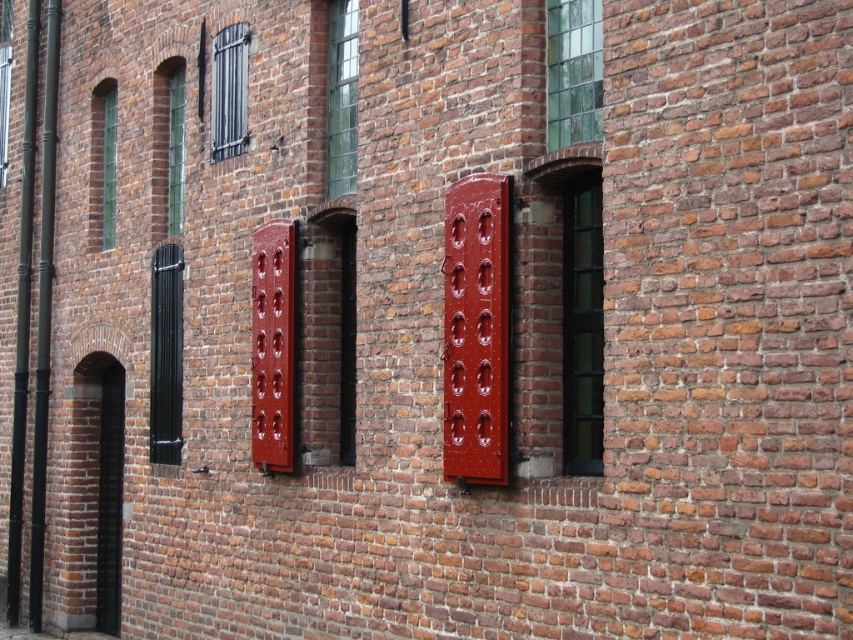
Which of these two, green glass window at upper center or green stained glass window at upper left, stands taller?

With more height is green stained glass window at upper left.

Who is lower down, green glass window at upper center or green stained glass window at upper left?

Positioned lower is green stained glass window at upper left.

You are a GUI agent. You are given a task and a screenshot of the screen. Output one action in this format:
    pyautogui.click(x=<x>, y=<y>)
    Task: Click on the green glass window at upper center
    Image resolution: width=853 pixels, height=640 pixels.
    Given the screenshot: What is the action you would take?
    pyautogui.click(x=341, y=97)

This screenshot has height=640, width=853. Describe the element at coordinates (228, 92) in the screenshot. I see `matte black shutters at upper left` at that location.

Can you confirm if matte black shutters at upper left is wider than matte black shutter at left?

Indeed, matte black shutters at upper left has a greater width compared to matte black shutter at left.

Is point (234, 54) positioned in front of point (4, 83)?

Yes, it is in front of point (4, 83).

You are a GUI agent. You are given a task and a screenshot of the screen. Output one action in this format:
    pyautogui.click(x=<x>, y=<y>)
    Task: Click on the matte black shutters at upper left
    The width and height of the screenshot is (853, 640).
    Given the screenshot: What is the action you would take?
    pyautogui.click(x=228, y=92)

Who is positioned more to the left, clear glass window at upper left or matte black shutter at left?

matte black shutter at left

Does clear glass window at upper left appear under matte black shutter at left?

Yes, clear glass window at upper left is below matte black shutter at left.

Does point (178, 161) come closer to viewer compared to point (4, 44)?

That is True.

Find the location of a particular element. clear glass window at upper left is located at coordinates (175, 150).